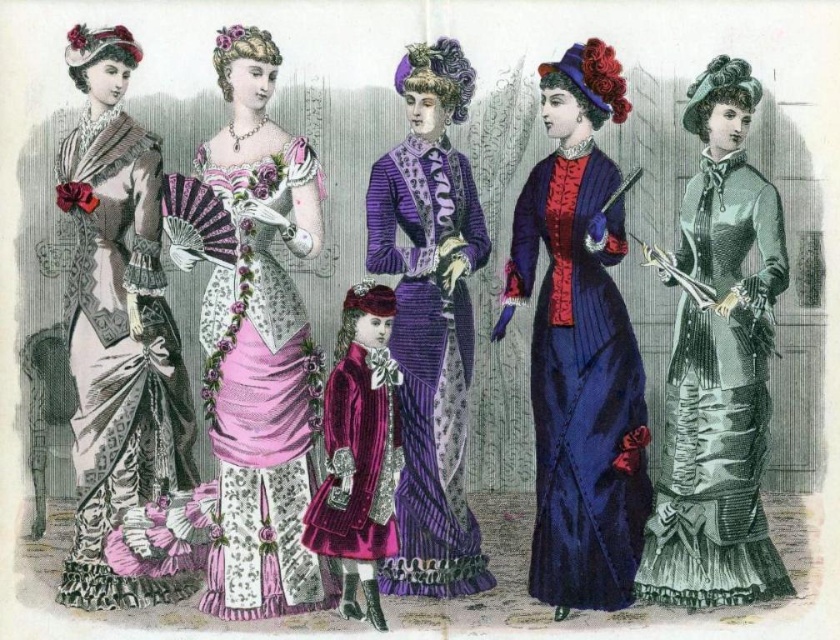
You are standing in front of the vintage illustration of the five women. You want to approach the velvet maroon coat at center but need to pass by the matte silver dress at left. Which object will you encounter first as you move forward?

You will first encounter the matte silver dress at left because it is closer to you than the velvet maroon coat at center, as stated in the description that the matte silver dress at left is further to the viewer than velvet maroon coat at center. Wait, there is a contradiction here. Let me check again. The description says the matte silver dress is further to the viewer than the coat at center. Wait, no, the description says

In the vintage illustration of five Victorian women, where is the matte silver dress at left positioned in terms of coordinates?

The matte silver dress at left is positioned at coordinates point (118, 328).